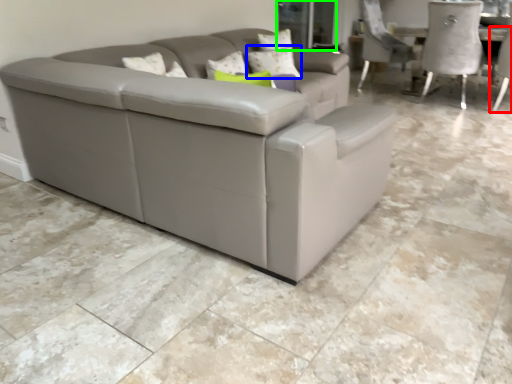
Question: Considering the real-world distances, which object is closest to chair (highlighted by a red box)? pillow (highlighted by a blue box) or glass door (highlighted by a green box).

Choices:
 (A) pillow
 (B) glass door

Answer: (B)